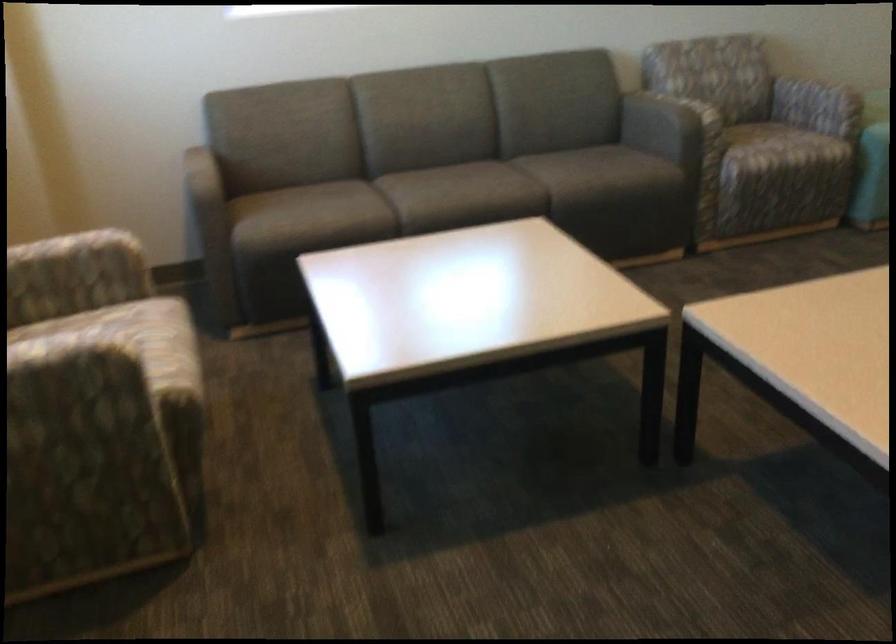
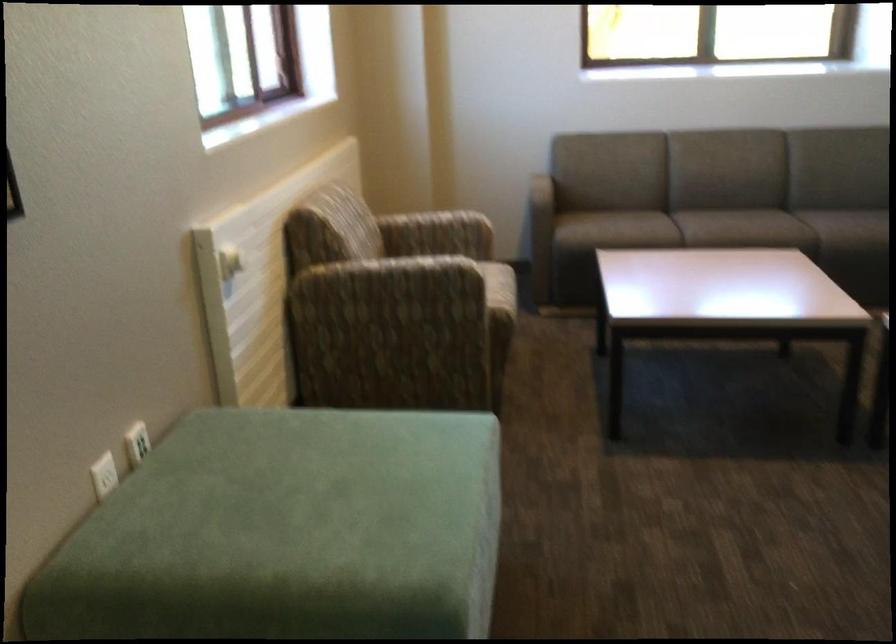
Find the pixel in the second image that matches pixel 513 187 in the first image.

(780, 229)